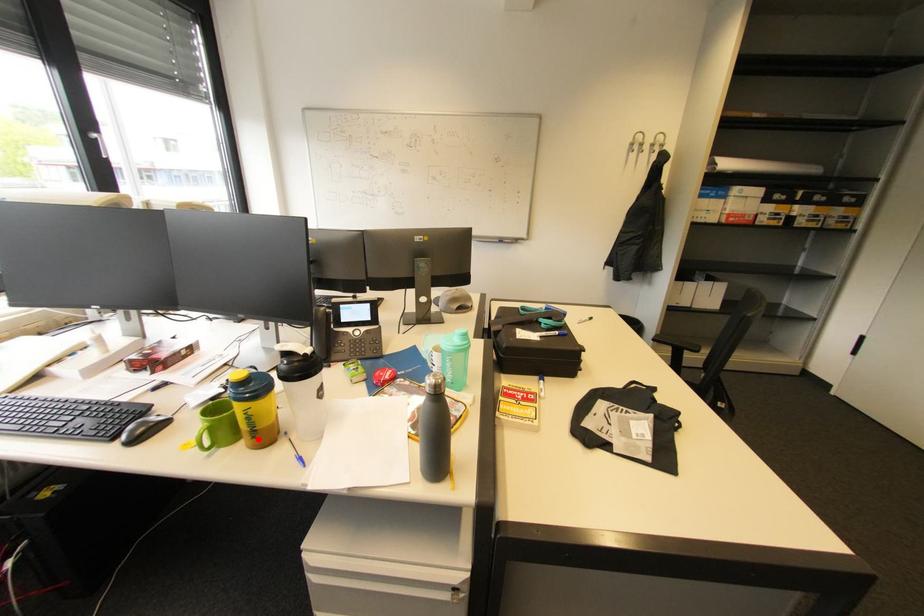
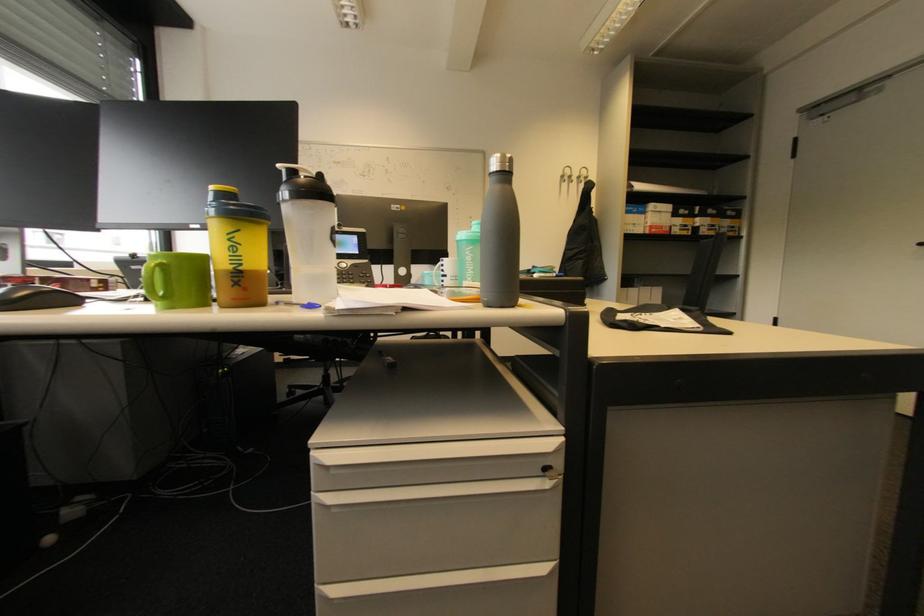
Where in the second image is the point corresponding to the highlighted location from the first image?

(239, 286)